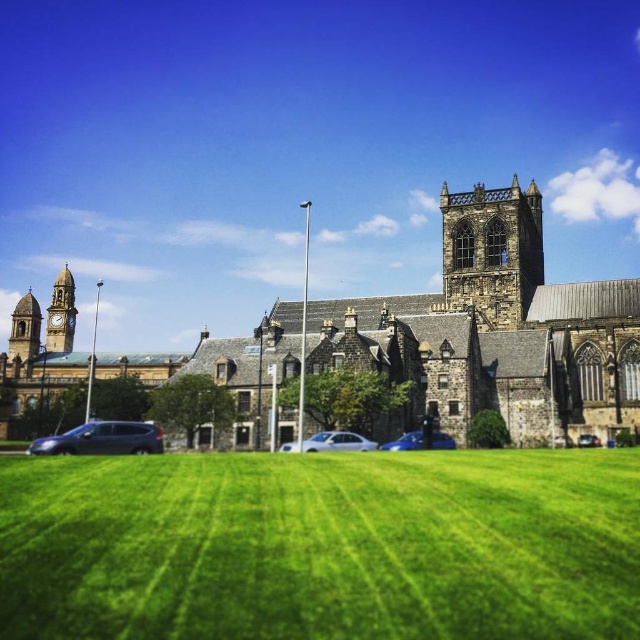
You are standing in front of the cathedral and want to take a photo that includes both the dark gray stone tower at center and the metallic silver car at lower left. Which object should be placed closer to the camera to ensure both are in focus?

The dark gray stone tower at center is taller than the metallic silver car at lower left, so to ensure both are in focus, you should place the metallic silver car at lower left closer to the camera.